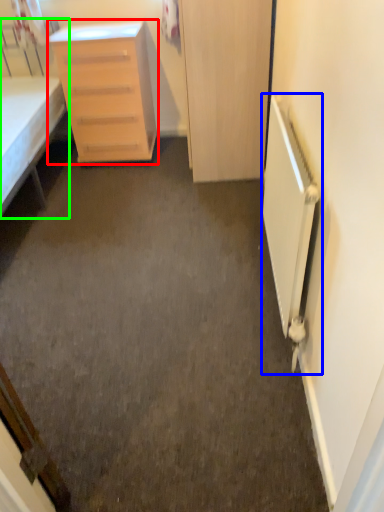
Question: Considering the real-world distances, which object is farthest from chest of drawers (highlighted by a red box)? radiator (highlighted by a blue box) or bed (highlighted by a green box)?

Choices:
 (A) radiator
 (B) bed

Answer: (A)